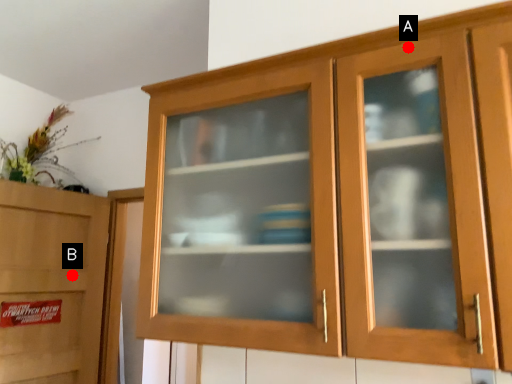
Question: Two points are circled on the image, labeled by A and B beside each circle. Which point is closer to the camera?

Choices:
 (A) A is closer
 (B) B is closer

Answer: (A)